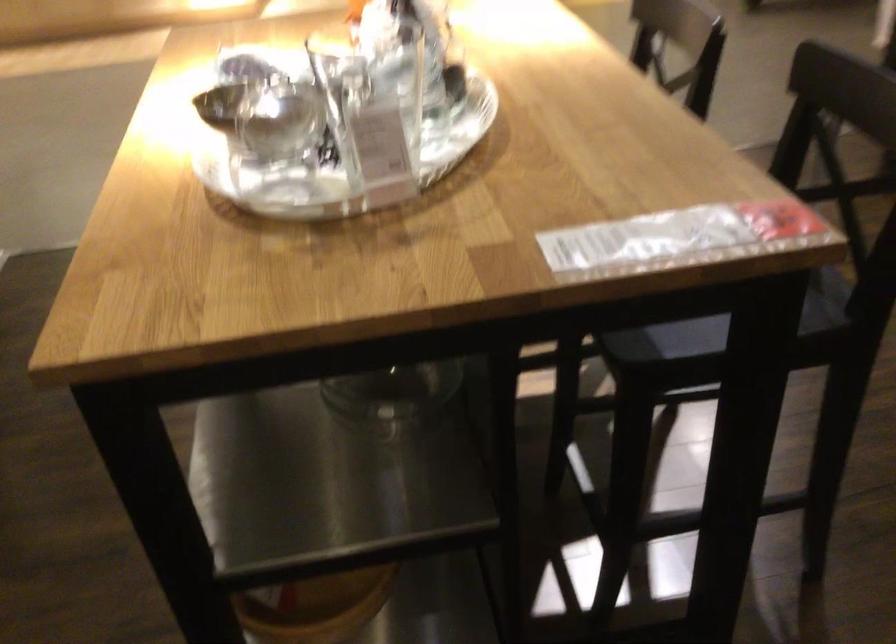
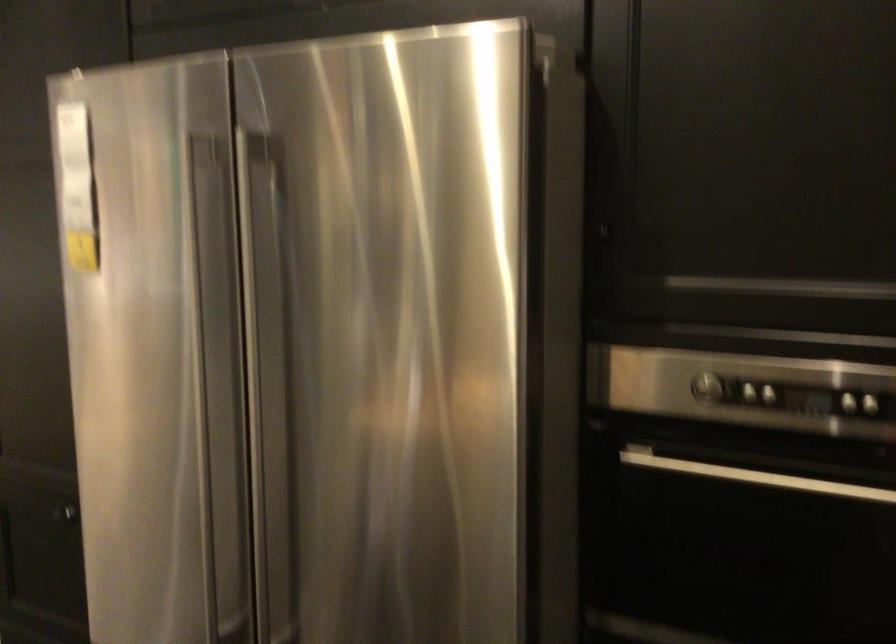
First-person continuous shooting, in which direction is the camera rotating?

The rotation direction of the camera is right-up.